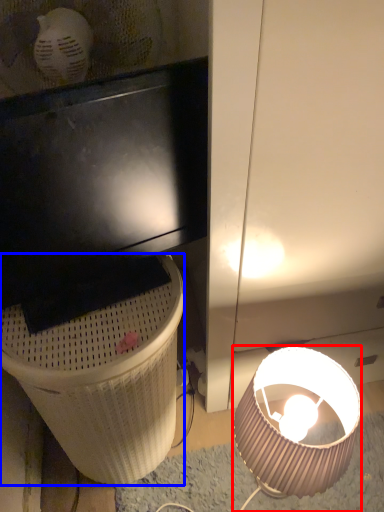
Question: Which point is closer to the camera, lamp (highlighted by a red box) or trash bin/can (highlighted by a blue box)?

Choices:
 (A) lamp
 (B) trash bin/can

Answer: (B)